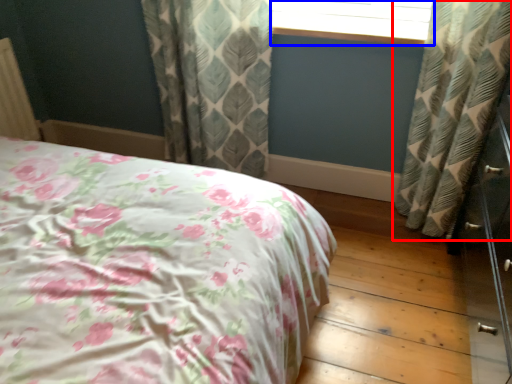
Question: Which object appears closest to the camera in this image, curtain (highlighted by a red box) or window frame (highlighted by a blue box)?

Choices:
 (A) curtain
 (B) window frame

Answer: (A)